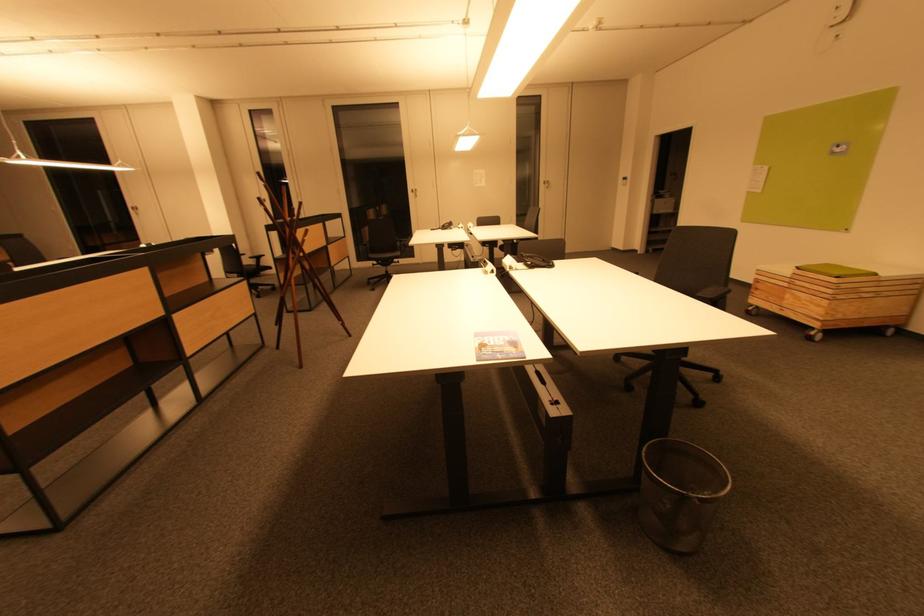
Where is `wheeled wooden cart`? This screenshot has height=616, width=924. wheeled wooden cart is located at coordinates (840, 292).